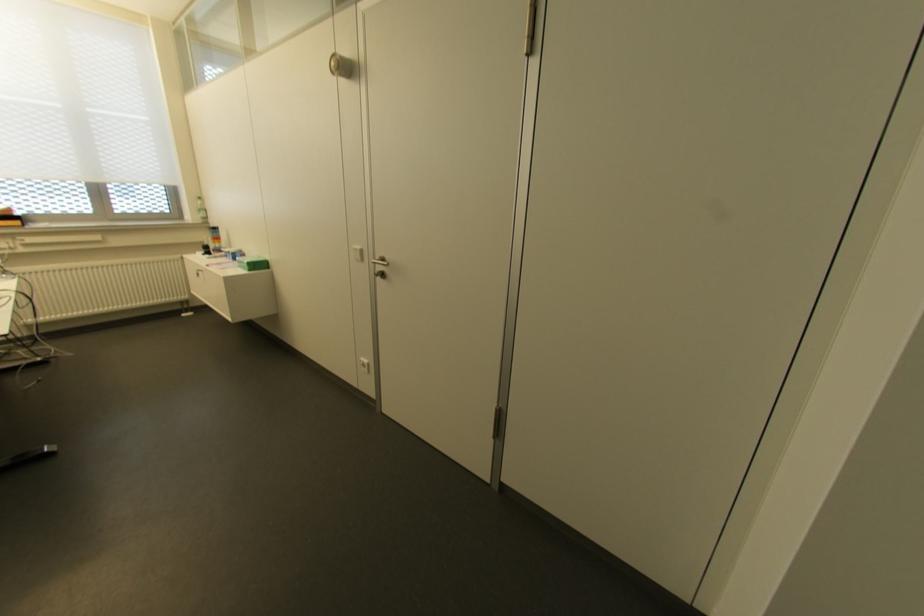
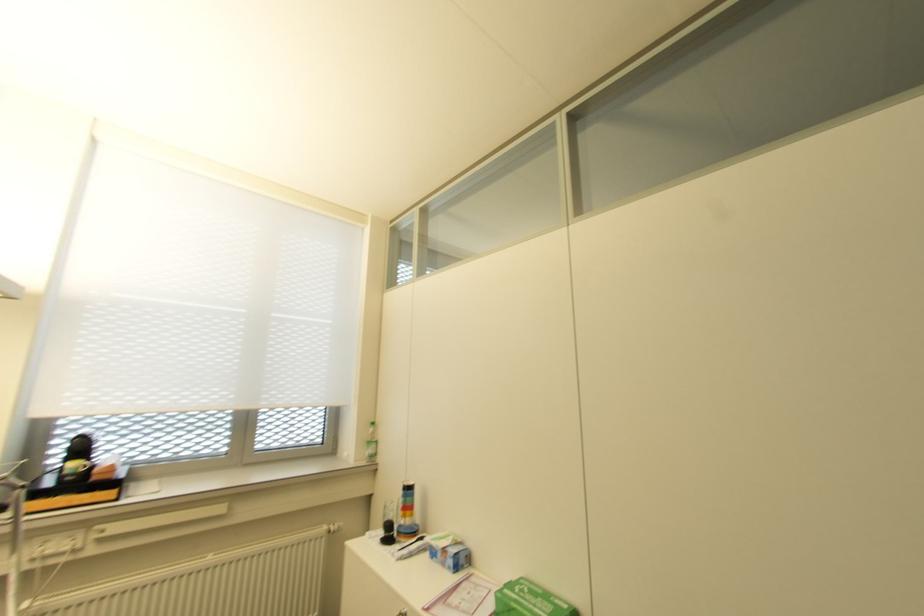
In the second image, find the point that corresponds to point (233, 259) in the first image.

(454, 568)